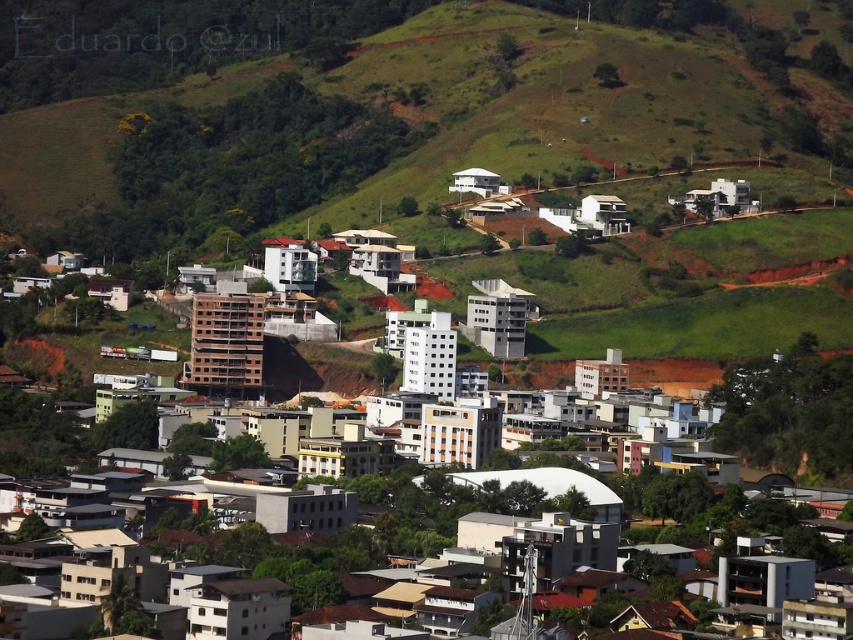
Which is behind, point (386, 81) or point (831, 403)?

Point (831, 403)

Who is lower down, green grassy hillside at upper center or white matte building at center?

Positioned lower is white matte building at center.

Who is more distant from viewer, (810, 161) or (184, 465)?

Positioned behind is point (810, 161).

You are a GUI agent. You are given a task and a screenshot of the screen. Output one action in this format:
    pyautogui.click(x=<x>, y=<y>)
    Task: Click on the green grassy hillside at upper center
    
    Given the screenshot: What is the action you would take?
    pyautogui.click(x=399, y=108)